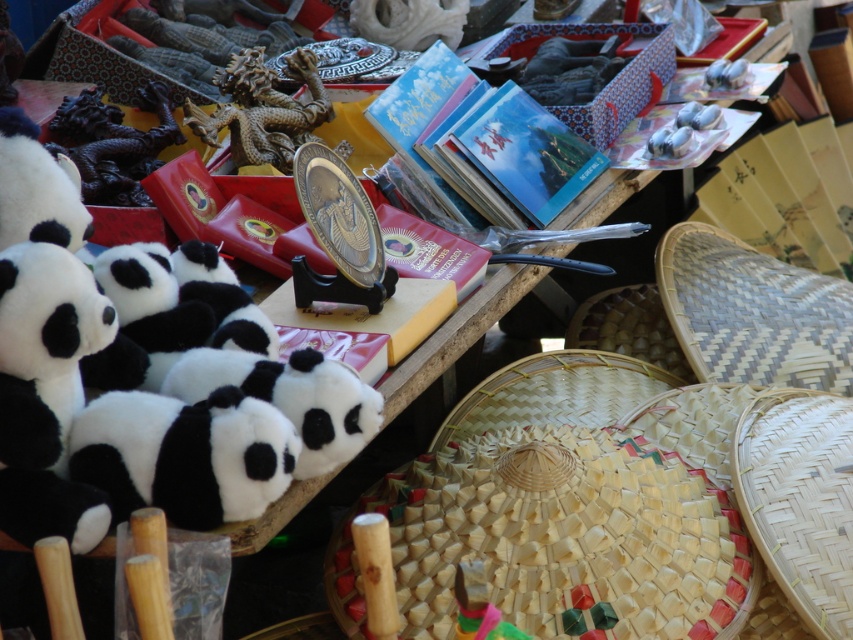
You are standing at the entrance of the market stall and want to locate the soft plush panda at left. According to the coordinates given, where exactly is it positioned in the image?

The soft plush panda at left is positioned at coordinates point (49, 353) in the image.

You are a customer at the market stall and want to pick up both the soft plush panda at left and the metallic dragon at center. If you can only carry items within a 1.5 meter reach, can you grab both without moving your position?

The soft plush panda at left is 1.38 meters from the metallic dragon at center, so yes, you can grab both items without moving your position since the distance between them is within your 1.5 meter reach.